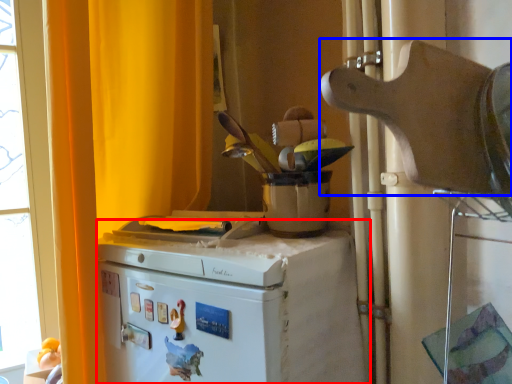
Question: Among these objects, which one is nearest to the camera, home appliance (highlighted by a red box) or appliance (highlighted by a blue box)?

Choices:
 (A) home appliance
 (B) appliance

Answer: (B)